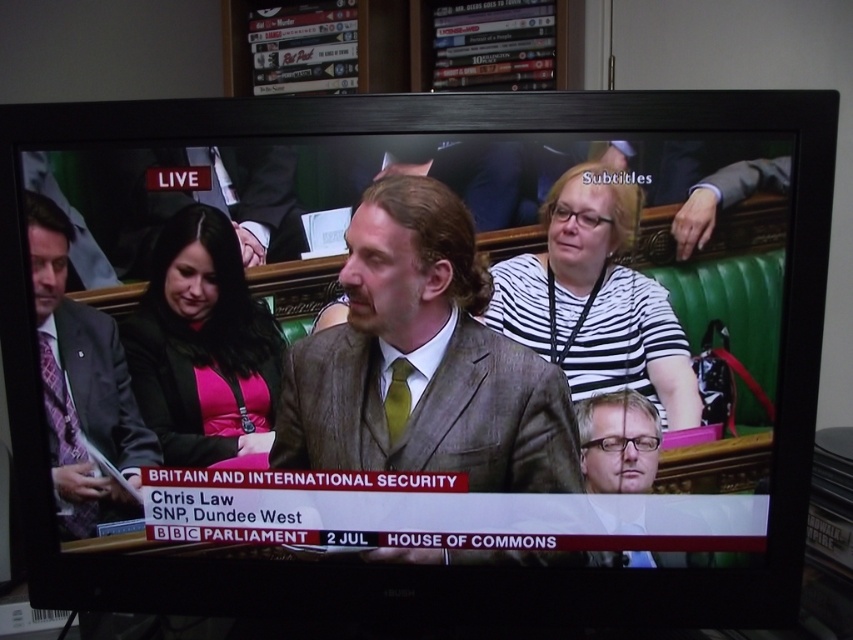
Based on the photo, between matte brown suit at center and striped fabric shirt at center, which one has more height?

With more height is matte brown suit at center.

Is matte brown suit at center smaller than striped fabric shirt at center?

Incorrect, matte brown suit at center is not smaller in size than striped fabric shirt at center.

What do you see at coordinates (422, 362) in the screenshot?
I see `matte brown suit at center` at bounding box center [422, 362].

Where is `matte brown suit at center`? This screenshot has height=640, width=853. matte brown suit at center is located at coordinates (422, 362).

Can you confirm if matte brown suit at center is wider than matte purple tie at left?

Correct, the width of matte brown suit at center exceeds that of matte purple tie at left.

Is matte brown suit at center shorter than matte purple tie at left?

Yes, matte brown suit at center is shorter than matte purple tie at left.

Measure the distance between matte brown suit at center and camera.

25.84 inches

Find the location of a particular element. This screenshot has width=853, height=640. matte brown suit at center is located at coordinates click(422, 362).

Is matte brown suit at center above pink fabric at center?

Actually, matte brown suit at center is below pink fabric at center.

Where is `matte brown suit at center`? The image size is (853, 640). matte brown suit at center is located at coordinates (422, 362).

Locate an element on the screen. matte brown suit at center is located at coordinates (422, 362).